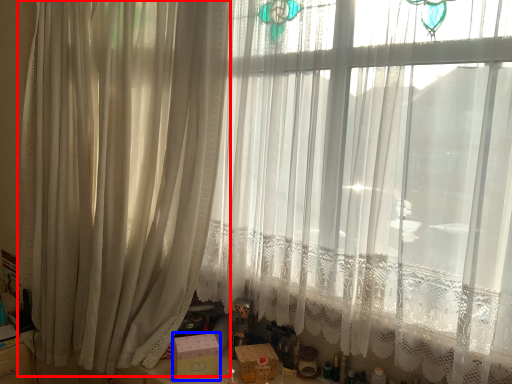
Question: Which object is further to the camera taking this photo, curtain (highlighted by a red box) or box (highlighted by a blue box)?

Choices:
 (A) curtain
 (B) box

Answer: (B)